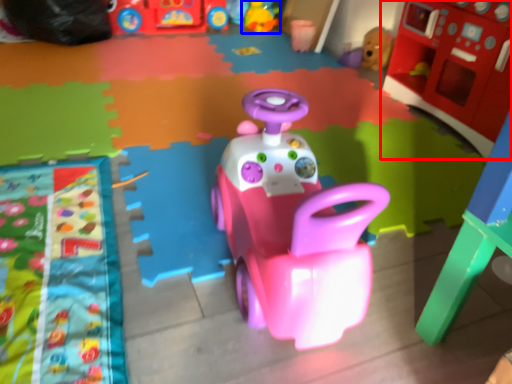
Question: Which object appears closest to the camera in this image, toy (highlighted by a red box) or toy (highlighted by a blue box)?

Choices:
 (A) toy
 (B) toy

Answer: (A)